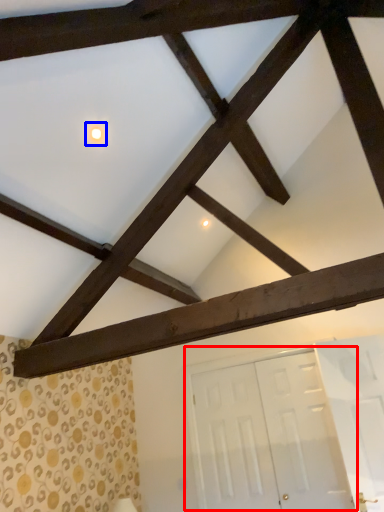
Question: Which object is further to the camera taking this photo, door (highlighted by a red box) or light (highlighted by a blue box)?

Choices:
 (A) door
 (B) light

Answer: (A)